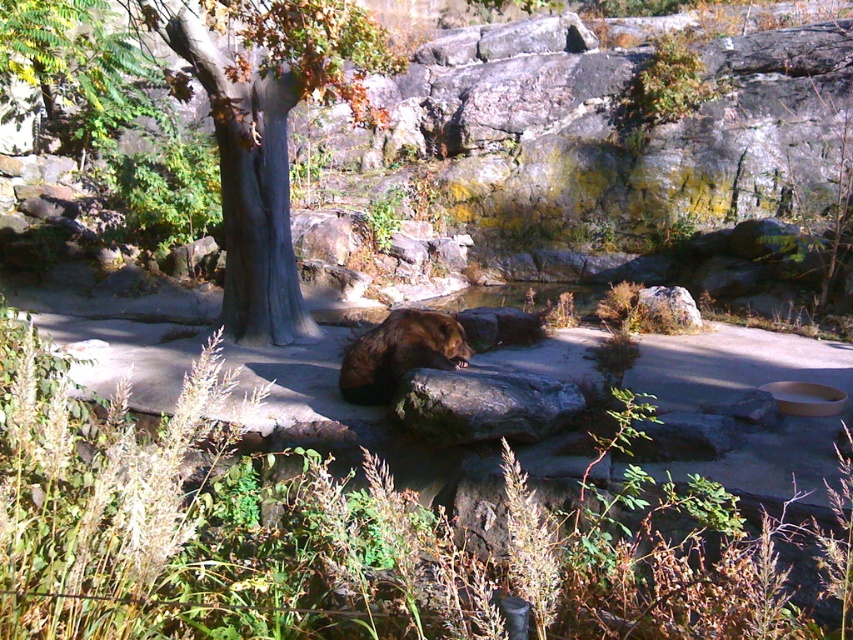
You are a zookeeper standing in front of the brown wood tree at center and the gray rough rock at center. You need to place a feeding tray on the closest object to you. Which object should you choose?

You should place the feeding tray on the gray rough rock at center because it is closer to you than the brown wood tree at center, which is further away.

You are a zookeeper planning to feed the brown furry bear at center. You have a food container that can only hold enough food for an animal occupying the space of the gray rough rock at center. Do you need to get a larger container?

The gray rough rock at center occupies less space than brown furry bear at center, so yes, you need to get a larger container to accommodate the brown furry bear at center.

You are a zookeeper planning to install a camera to monitor the brown wood tree at center and the brown furry bear at center. Since the camera can only focus on one object at a time, which object should you prioritize placing the camera closer to?

The brown wood tree at center is much taller than the brown furry bear at center, so the camera should be placed closer to the brown furry bear at center to ensure proper focus.